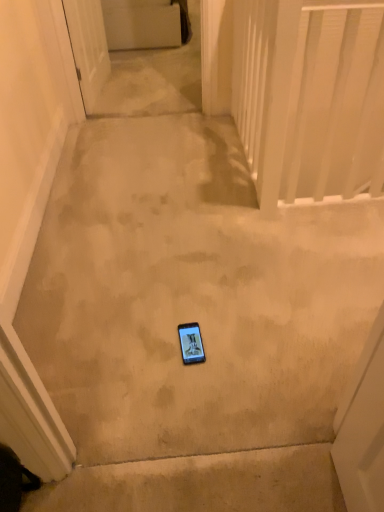
I want to click on free space to the right of matte black phone at center, so click(236, 345).